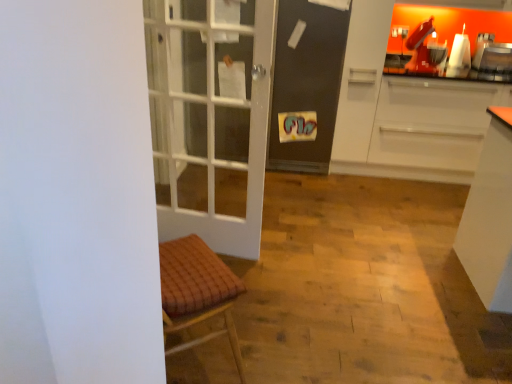
You are a GUI agent. You are given a task and a screenshot of the screen. Output one action in this format:
    pyautogui.click(x=<x>, y=<y>)
    Task: Click on the metallic silver toaster at upper right
    The width and height of the screenshot is (512, 384).
    Given the screenshot: What is the action you would take?
    pyautogui.click(x=493, y=60)

The height and width of the screenshot is (384, 512). What are the coordinates of `metallic silver toaster at upper right` in the screenshot? It's located at (493, 60).

Considering the relative sizes of metallic silver toaster at upper right and white matte cabinet at right in the image provided, is metallic silver toaster at upper right thinner than white matte cabinet at right?

Yes.

From a real-world perspective, is metallic silver toaster at upper right under white matte cabinet at right?

No, from a real-world perspective, metallic silver toaster at upper right is not under white matte cabinet at right.

You are a GUI agent. You are given a task and a screenshot of the screen. Output one action in this format:
    pyautogui.click(x=<x>, y=<y>)
    Task: Click on the appliance above the white matte cabinet at right (from a real-world perspective)
    
    Given the screenshot: What is the action you would take?
    pyautogui.click(x=493, y=60)

From the image's perspective, who appears lower, metallic silver toaster at upper right or white matte cabinet at right?

white matte cabinet at right, from the image's perspective.

Is matte black screen door at center with metallic silver toaster at upper right?

matte black screen door at center and metallic silver toaster at upper right are not in contact.

Which of these two, matte black screen door at center or metallic silver toaster at upper right, is wider?

Wider between the two is matte black screen door at center.

Looking at this image, would you say matte black screen door at center is to the left or to the right of metallic silver toaster at upper right in the picture?

Clearly, matte black screen door at center is on the left of metallic silver toaster at upper right in the image.

In the scene shown: Considering the relative sizes of white matte cabinet at right and metallic silver toaster at upper right in the image provided, is white matte cabinet at right bigger than metallic silver toaster at upper right?

Yes, white matte cabinet at right is bigger than metallic silver toaster at upper right.

Does white matte cabinet at right have a greater width compared to metallic silver toaster at upper right?

Yes.

Is white matte cabinet at right looking in the opposite direction of metallic silver toaster at upper right?

Yes, white matte cabinet at right is positioned with its back facing metallic silver toaster at upper right.

Is white matte cabinet at right with metallic silver toaster at upper right?

white matte cabinet at right and metallic silver toaster at upper right are clearly separated.

Does white matte cabinet at right come in front of matte black screen door at center?

Yes, white matte cabinet at right is closer to the camera.

Considering the sizes of white matte cabinet at right and matte black screen door at center in the image, is white matte cabinet at right bigger or smaller than matte black screen door at center?

Clearly, white matte cabinet at right is larger in size than matte black screen door at center.

From the image's perspective, is white matte cabinet at right on matte black screen door at center?

Actually, white matte cabinet at right appears below matte black screen door at center in the image.

The image size is (512, 384). In order to click on screen door below the white matte cabinet at right (from a real-world perspective) in this screenshot , I will do `click(306, 85)`.

From the picture: From a real-world perspective, is matte black screen door at center beneath white matte cabinet at right?

Yes.

How different are the orientations of matte black screen door at center and white matte cabinet at right in degrees?

There is a 1.61e-05-degree angle between the facing directions of matte black screen door at center and white matte cabinet at right.

Which object is more forward, matte black screen door at center or white matte cabinet at right?

white matte cabinet at right is more forward.

Is matte black screen door at center to the left or to the right of white matte cabinet at right in the image?

Clearly, matte black screen door at center is on the left of white matte cabinet at right in the image.

From the image's perspective, is metallic silver toaster at upper right located beneath matte black screen door at center?

Incorrect, from the image's perspective, metallic silver toaster at upper right is higher than matte black screen door at center.

Considering the sizes of objects metallic silver toaster at upper right and matte black screen door at center in the image provided, who is taller, metallic silver toaster at upper right or matte black screen door at center?

Standing taller between the two is matte black screen door at center.

Which of these two, metallic silver toaster at upper right or matte black screen door at center, is thinner?

metallic silver toaster at upper right is thinner.

From a real-world perspective, is metallic silver toaster at upper right physically located above or below matte black screen door at center?

In terms of real-world spatial position, metallic silver toaster at upper right is above matte black screen door at center.

Identify the location of cabinetry below the metallic silver toaster at upper right (from the image's perspective). (407, 107).

Identify the location of appliance that appears above the matte black screen door at center (from the image's perspective). (493, 60).

Looking at the image, which one is located further to metallic silver toaster at upper right, white matte cabinet at right or matte black screen door at center?

matte black screen door at center is positioned further to the anchor metallic silver toaster at upper right.

From the image, which object appears to be nearer to matte black screen door at center, white matte cabinet at right or metallic silver toaster at upper right?

The object closer to matte black screen door at center is white matte cabinet at right.

Considering their positions, is metallic silver toaster at upper right positioned closer to white matte cabinet at right than matte black screen door at center?

matte black screen door at center is closer to white matte cabinet at right.

Which object lies nearer to the anchor point matte black screen door at center, metallic silver toaster at upper right or white matte cabinet at right?

The object closer to matte black screen door at center is white matte cabinet at right.

Looking at the image, which one is located further to metallic silver toaster at upper right, matte black screen door at center or white matte cabinet at right?

matte black screen door at center is further to metallic silver toaster at upper right.

Which object lies further to the anchor point white matte cabinet at right, matte black screen door at center or metallic silver toaster at upper right?

The object further to white matte cabinet at right is metallic silver toaster at upper right.

The height and width of the screenshot is (384, 512). Find the location of `cabinetry between matte black screen door at center and metallic silver toaster at upper right in the horizontal direction`. cabinetry between matte black screen door at center and metallic silver toaster at upper right in the horizontal direction is located at coordinates (407, 107).